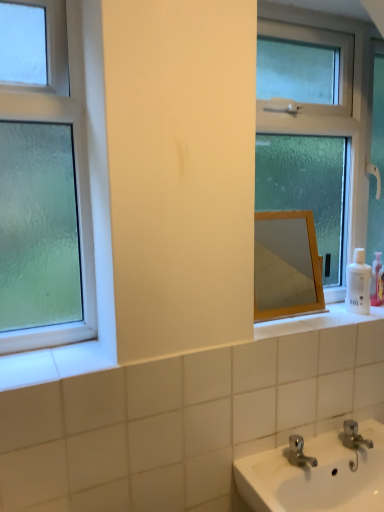
Question: From a real-world perspective, is wooden mirror at center physically below clear glass window at center, which ranks as the first window in right-to-left order?

Choices:
 (A) no
 (B) yes

Answer: (B)

Question: Considering the relative sizes of wooden mirror at center and clear glass window at center, marked as the first window in a back-to-front arrangement, in the image provided, is wooden mirror at center taller than clear glass window at center, marked as the first window in a back-to-front arrangement,?

Choices:
 (A) no
 (B) yes

Answer: (A)

Question: Does wooden mirror at center have a lesser height compared to clear glass window at center, which ranks as the first window in right-to-left order?

Choices:
 (A) no
 (B) yes

Answer: (B)

Question: Is wooden mirror at center positioned far away from clear glass window at center, marked as the first window in a back-to-front arrangement?

Choices:
 (A) yes
 (B) no

Answer: (A)

Question: Is wooden mirror at center facing away from clear glass window at center, marked as the first window in a back-to-front arrangement?

Choices:
 (A) no
 (B) yes

Answer: (B)

Question: Based on their sizes in the image, would you say wooden mirror at center is bigger or smaller than white plastic bottle at right?

Choices:
 (A) big
 (B) small

Answer: (A)

Question: Is wooden mirror at center taller or shorter than white plastic bottle at right?

Choices:
 (A) short
 (B) tall

Answer: (B)

Question: Is wooden mirror at center wider or thinner than white plastic bottle at right?

Choices:
 (A) thin
 (B) wide

Answer: (B)

Question: Choose the correct answer: Is wooden mirror at center inside white plastic bottle at right or outside it?

Choices:
 (A) inside
 (B) outside

Answer: (B)

Question: Is white plastic bottle at right taller or shorter than wooden mirror at center?

Choices:
 (A) short
 (B) tall

Answer: (A)

Question: Is white plastic bottle at right inside the boundaries of wooden mirror at center, or outside?

Choices:
 (A) outside
 (B) inside

Answer: (A)

Question: In terms of size, does white plastic bottle at right appear bigger or smaller than wooden mirror at center?

Choices:
 (A) big
 (B) small

Answer: (B)

Question: In terms of width, does white plastic bottle at right look wider or thinner when compared to wooden mirror at center?

Choices:
 (A) wide
 (B) thin

Answer: (B)

Question: In terms of height, does green frosted glass window at left, marked as the second window in a right-to-left arrangement, look taller or shorter compared to white plastic bottle at right?

Choices:
 (A) tall
 (B) short

Answer: (A)

Question: Is point (3, 374) closer or farther from the camera than point (352, 307)?

Choices:
 (A) closer
 (B) farther

Answer: (A)